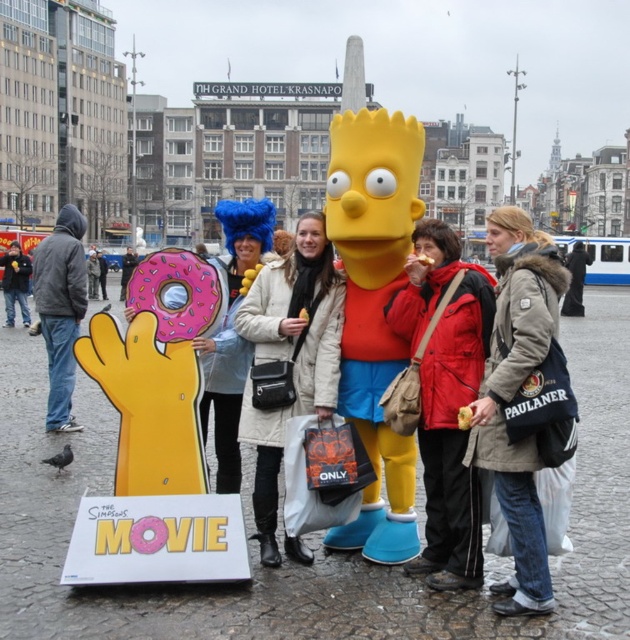
Question: Among these points, which one is nearest to the camera?

Choices:
 (A) (x=209, y=360)
 (B) (x=69, y=218)
 (C) (x=580, y=298)
 (D) (x=551, y=250)

Answer: (D)

Question: Is light brown leather jacket at center further to camera compared to red jacket at center?

Choices:
 (A) yes
 (B) no

Answer: (B)

Question: Is dark gray hoodie at left below black leather jacket at right?

Choices:
 (A) yes
 (B) no

Answer: (B)

Question: Which object is closer to the camera taking this photo?

Choices:
 (A) light brown leather jacket at center
 (B) white wool coat at center
 (C) jeans at center
 (D) black leather jacket at right

Answer: (A)

Question: From the image, what is the correct spatial relationship of white wool coat at center in relation to blue fuzzy wig at center?

Choices:
 (A) left
 (B) right

Answer: (B)

Question: Estimate the real-world distances between objects in this image. Which object is farther from the white wool coat at center?

Choices:
 (A) yellow matte bart simpson at center
 (B) dark gray hoodie at left

Answer: (B)